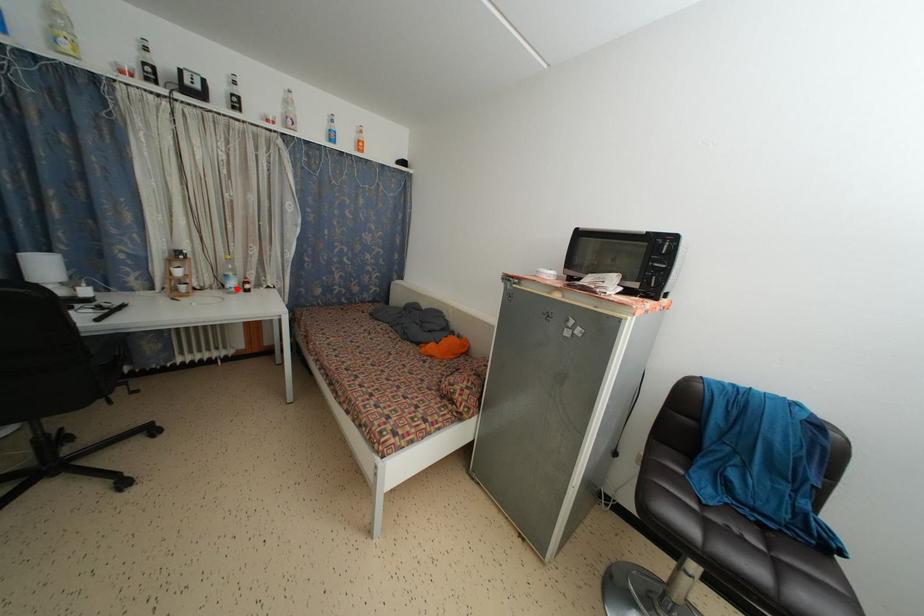
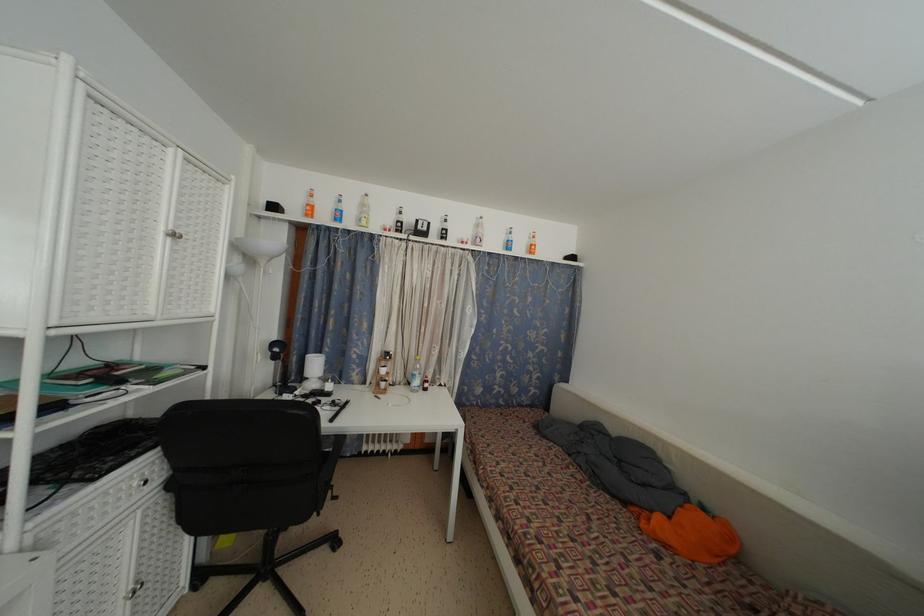
Find the pixel in the second image that matches the highlighted location in the first image.

(420, 387)